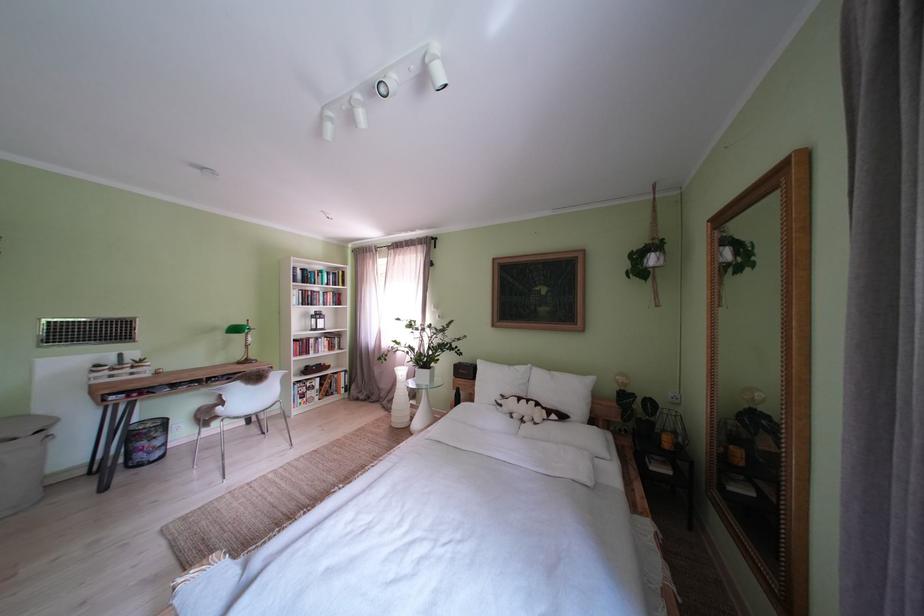
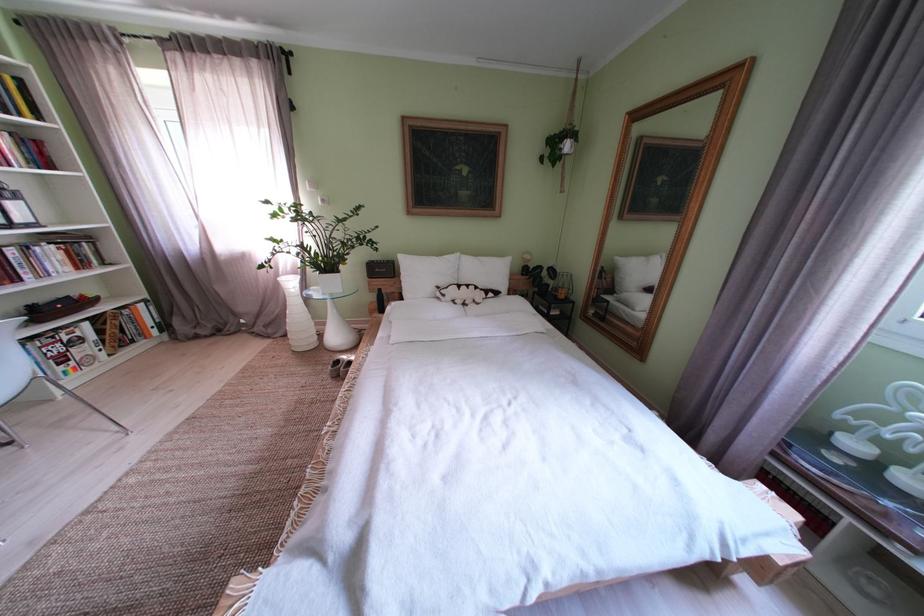
Find the pixel in the second image that matches pixel 347 282 in the first image.

(9, 92)